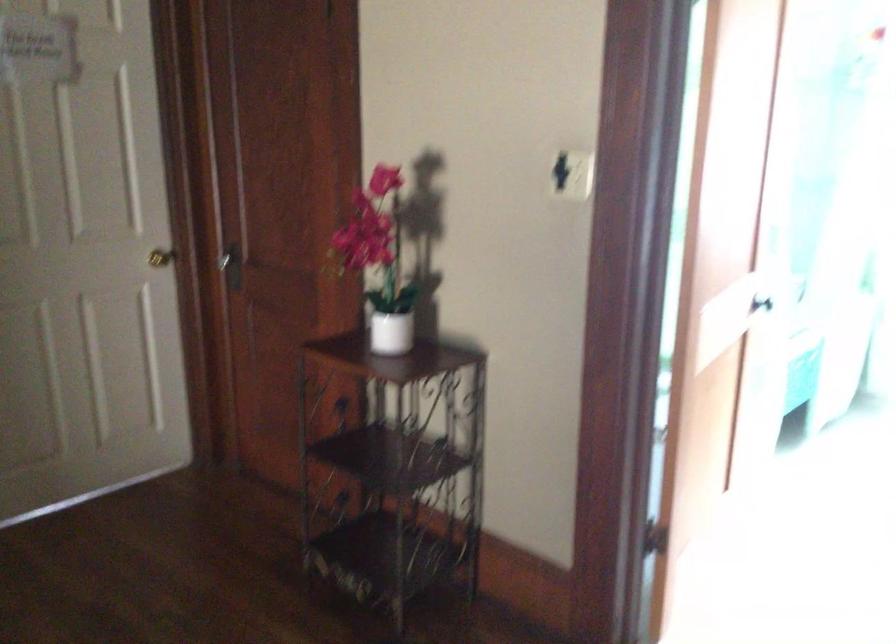
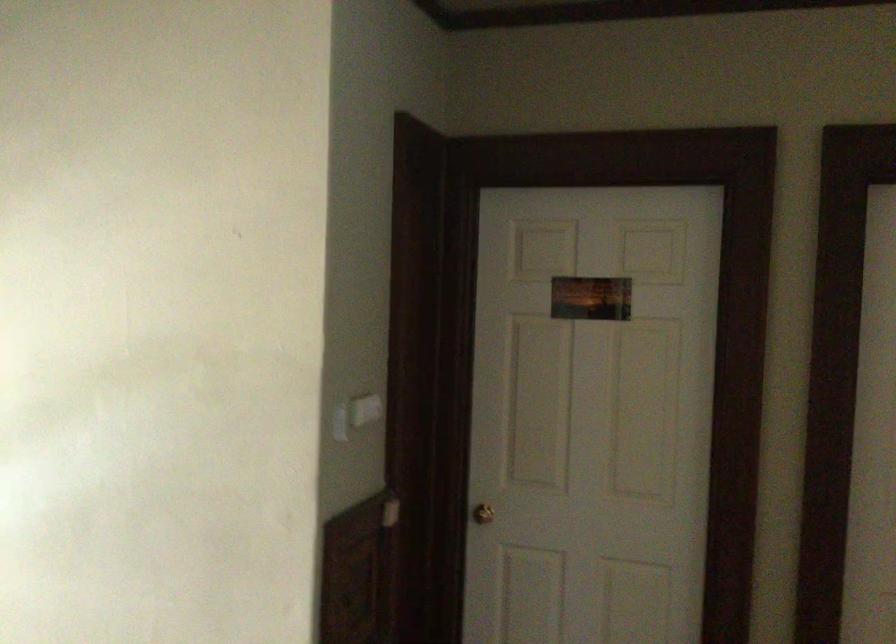
Question: The camera is either moving clockwise (left) or counter-clockwise (right) around the object. The first image is from the beginning of the video and the second image is from the end. Is the camera moving left or right when shooting the video?

Choices:
 (A) Left
 (B) Right

Answer: (B)